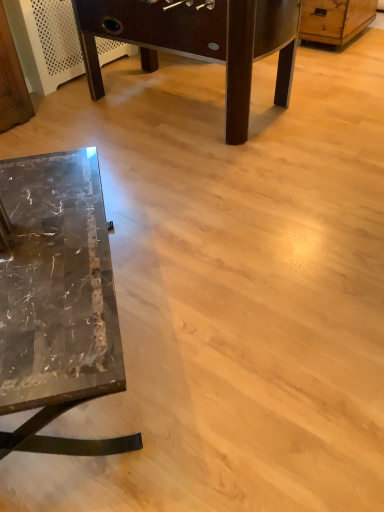
The height and width of the screenshot is (512, 384). What are the coordinates of `empty space that is in between marble table at lower left, which appears as the 1th table when viewed from the front, and marble table at lower left, which is the 1th table in top-to-bottom order` in the screenshot? It's located at (183, 211).